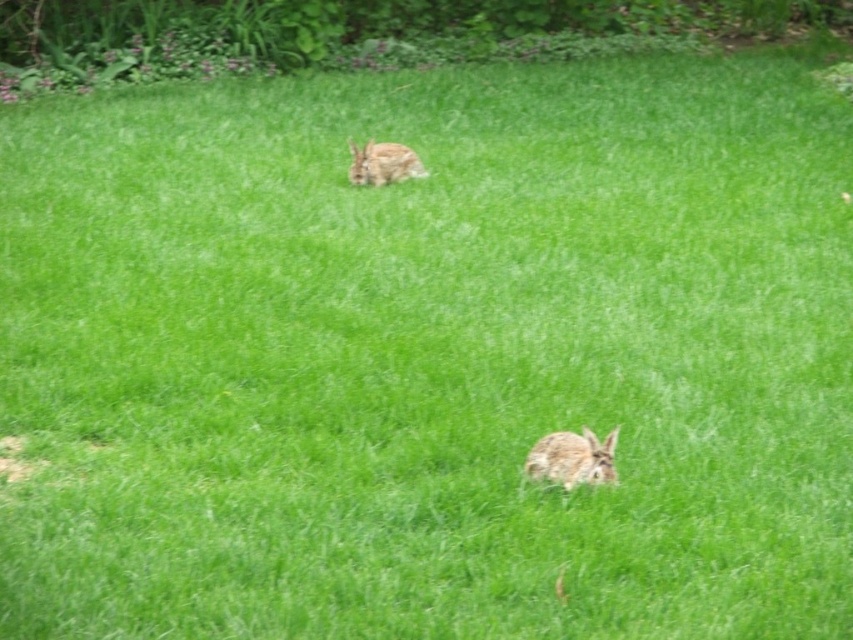
You are a photographer trying to capture both rabbits in a single shot. Since you want to include both the fuzzy brown rabbit at lower center and the fuzzy brown rabbit at upper center in your photo, which rabbit should you position your camera closer to in order to frame both effectively?

To frame both rabbits effectively, you should position your camera closer to the fuzzy brown rabbit at upper center because the fuzzy brown rabbit at lower center is to the right of it, allowing you to adjust the angle to include both in the shot.